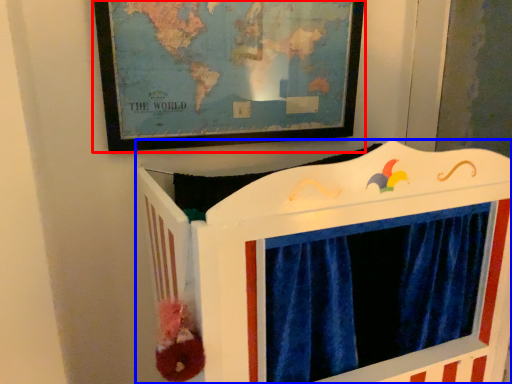
Question: Which point is closer to the camera, picture frame (highlighted by a red box) or furniture (highlighted by a blue box)?

Choices:
 (A) picture frame
 (B) furniture

Answer: (B)